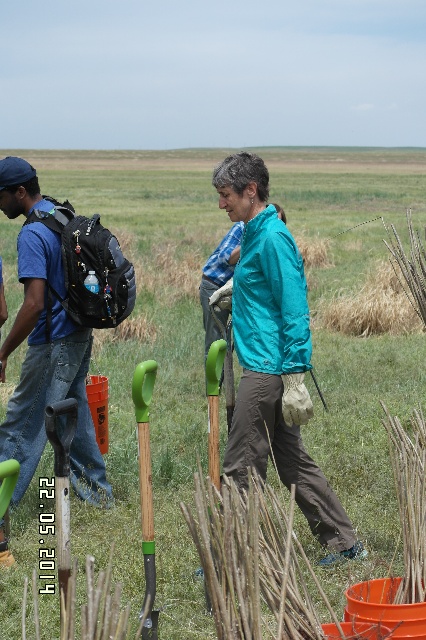
Based on the photo, does matte black backpack at left appear under green wood shovel at center?

No.

Can you confirm if matte black backpack at left is bigger than green wood shovel at center?

Yes, matte black backpack at left is bigger than green wood shovel at center.

Is point (54, 300) positioned behind point (146, 365)?

Yes, point (54, 300) is farther from viewer.

Image resolution: width=426 pixels, height=640 pixels. What are the coordinates of `matte black backpack at left` in the screenshot? It's located at (48, 371).

Is teal fabric jacket at center further to the viewer compared to green wood shovel at center?

Yes, teal fabric jacket at center is further from the viewer.

Image resolution: width=426 pixels, height=640 pixels. In order to click on teal fabric jacket at center in this screenshot , I will do `click(273, 355)`.

What do you see at coordinates (273, 355) in the screenshot? I see `teal fabric jacket at center` at bounding box center [273, 355].

At what (x,y) coordinates should I click in order to perform the action: click on teal fabric jacket at center. Please return your answer as a coordinate pair (x, y). The height and width of the screenshot is (640, 426). Looking at the image, I should click on (273, 355).

Which is behind, point (244, 272) or point (48, 236)?

The point (48, 236) is more distant.

Who is lower down, teal fabric jacket at center or matte black backpack at left?

teal fabric jacket at center is below.

The height and width of the screenshot is (640, 426). What are the coordinates of `teal fabric jacket at center` in the screenshot? It's located at (273, 355).

This screenshot has height=640, width=426. I want to click on teal fabric jacket at center, so click(273, 355).